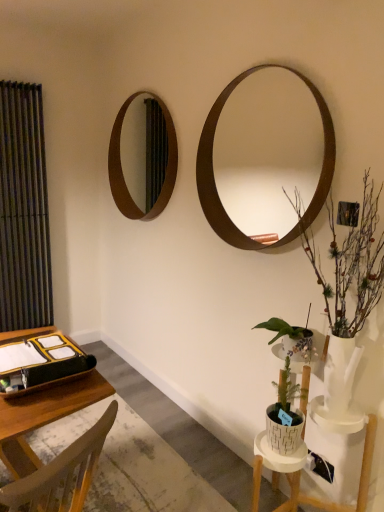
Consider the image. How much space does white textured pot at lower right, which is the 2th houseplant in top-to-bottom order, occupy vertically?

21.12 centimeters.

Measure the distance between point [304,354] and camera.

A distance of 1.69 meters exists between point [304,354] and camera.

Where is `matte black curtain at left`? The height and width of the screenshot is (512, 384). matte black curtain at left is located at coordinates (24, 211).

Between wooden desk at lower left and matte black binder at lower left, which one has less height?

matte black binder at lower left.

Can you confirm if wooden desk at lower left is thinner than matte black binder at lower left?

Incorrect, the width of wooden desk at lower left is not less than that of matte black binder at lower left.

Is wooden desk at lower left to the left of matte black binder at lower left from the viewer's perspective?

Incorrect, wooden desk at lower left is not on the left side of matte black binder at lower left.

From the image's perspective, does wooden desk at lower left appear higher than matte black binder at lower left?

No, from the image's perspective, wooden desk at lower left is not above matte black binder at lower left.

Image resolution: width=384 pixels, height=512 pixels. In order to click on the 1st houseplant counting from the right side of the brown wooden mirror at upper left, the second mirror in the right-to-left sequence in this screenshot , I will do `click(294, 344)`.

Is white textured pot at lower right, which is the 2th houseplant in top-to-bottom order, oriented towards brown wooden mirror at upper left, marked as the 1th mirror in a back-to-front arrangement?

No, white textured pot at lower right, which is the 2th houseplant in top-to-bottom order, is not oriented towards brown wooden mirror at upper left, marked as the 1th mirror in a back-to-front arrangement.

From the image's perspective, which one is positioned lower, white textured pot at lower right, which is the 2th houseplant in top-to-bottom order, or brown wooden mirror at upper left, the second mirror in the right-to-left sequence?

white textured pot at lower right, which is the 2th houseplant in top-to-bottom order, appears lower in the image.

Is the depth of white textured pot at lower right, which is the 2th houseplant in top-to-bottom order, greater than that of brown wooden mirror at upper left, arranged as the 2th mirror when viewed from the front?

No, the depth of white textured pot at lower right, which is the 2th houseplant in top-to-bottom order, is less than that of brown wooden mirror at upper left, arranged as the 2th mirror when viewed from the front.

Is brown wooden mirror at upper left, the 1th mirror positioned from the left, taller than matte black curtain at left?

Incorrect, the height of brown wooden mirror at upper left, the 1th mirror positioned from the left, is not larger of that of matte black curtain at left.

Can you confirm if brown wooden mirror at upper left, the 1th mirror positioned from the left, is bigger than matte black curtain at left?

No, brown wooden mirror at upper left, the 1th mirror positioned from the left, is not bigger than matte black curtain at left.

Considering the relative positions of brown wooden mirror at upper left, arranged as the 2th mirror when viewed from the front, and matte black curtain at left in the image provided, is brown wooden mirror at upper left, arranged as the 2th mirror when viewed from the front, in front of matte black curtain at left?

Yes, the depth of brown wooden mirror at upper left, arranged as the 2th mirror when viewed from the front, is less than that of matte black curtain at left.

Looking at this image, could you tell me if matte black curtain at left is facing brown wooden mirror at upper right, acting as the 1th mirror starting from the front?

No, matte black curtain at left is not aimed at brown wooden mirror at upper right, acting as the 1th mirror starting from the front.

How distant is matte black curtain at left from brown wooden mirror at upper right, the second mirror viewed from the left?

matte black curtain at left and brown wooden mirror at upper right, the second mirror viewed from the left, are 7.16 feet apart.

Which is more to the right, matte black curtain at left or brown wooden mirror at upper right, placed as the first mirror when sorted from right to left?

brown wooden mirror at upper right, placed as the first mirror when sorted from right to left.

From the image's perspective, is matte black curtain at left below brown wooden mirror at upper right, the second mirror viewed from the left?

Yes, from the image's perspective, matte black curtain at left is beneath brown wooden mirror at upper right, the second mirror viewed from the left.

Is brown wooden mirror at upper right, which appears as the second mirror when viewed from the back, far from matte black binder at lower left?

brown wooden mirror at upper right, which appears as the second mirror when viewed from the back, is far away from matte black binder at lower left.

Does point (310, 92) come behind point (10, 353)?

Yes.

Considering the relative sizes of brown wooden mirror at upper right, placed as the first mirror when sorted from right to left, and matte black binder at lower left in the image provided, is brown wooden mirror at upper right, placed as the first mirror when sorted from right to left, thinner than matte black binder at lower left?

Indeed, brown wooden mirror at upper right, placed as the first mirror when sorted from right to left, has a lesser width compared to matte black binder at lower left.

From a real-world perspective, relative to matte black binder at lower left, is brown wooden mirror at upper right, placed as the first mirror when sorted from right to left, vertically above or below?

brown wooden mirror at upper right, placed as the first mirror when sorted from right to left, is situated higher than matte black binder at lower left in the real world.

From the image's perspective, is matte black binder at lower left positioned above or below wooden desk at lower left?

matte black binder at lower left is situated higher than wooden desk at lower left in the image.

Are matte black binder at lower left and wooden desk at lower left far apart?

No, there isn't a large distance between matte black binder at lower left and wooden desk at lower left.

From their relative heights in the image, would you say matte black binder at lower left is taller or shorter than wooden desk at lower left?

Considering their sizes, matte black binder at lower left has less height than wooden desk at lower left.

From a real-world perspective, is white textured vase at right, positioned as the 1th houseplant in top-to-bottom order, over brown wooden mirror at upper left, the 1th mirror positioned from the left?

Incorrect, from a real-world perspective, white textured vase at right, positioned as the 1th houseplant in top-to-bottom order, is lower than brown wooden mirror at upper left, the 1th mirror positioned from the left.

From the image's perspective, relative to brown wooden mirror at upper left, arranged as the 2th mirror when viewed from the front, is white textured vase at right, the second houseplant when ordered from bottom to top, above or below?

Based on their image positions, white textured vase at right, the second houseplant when ordered from bottom to top, is located beneath brown wooden mirror at upper left, arranged as the 2th mirror when viewed from the front.

Is white textured vase at right, positioned as the 1th houseplant in top-to-bottom order, next to brown wooden mirror at upper left, arranged as the 2th mirror when viewed from the front, and touching it?

No, white textured vase at right, positioned as the 1th houseplant in top-to-bottom order, is not making contact with brown wooden mirror at upper left, arranged as the 2th mirror when viewed from the front.

Which object is positioned more to the left, white textured vase at right, positioned as the 1th houseplant in top-to-bottom order, or brown wooden mirror at upper left, marked as the 1th mirror in a back-to-front arrangement?

brown wooden mirror at upper left, marked as the 1th mirror in a back-to-front arrangement.

Image resolution: width=384 pixels, height=512 pixels. Find the location of `binder lying behind the wooden desk at lower left`. binder lying behind the wooden desk at lower left is located at coordinates coord(40,362).

Find the location of `mirror that is the 2nd object to the left of the white textured pot at lower right, which is the 2th houseplant in top-to-bottom order, starting at the anchor`. mirror that is the 2nd object to the left of the white textured pot at lower right, which is the 2th houseplant in top-to-bottom order, starting at the anchor is located at coordinates (144, 150).

Considering their positions, is white textured vase at right, the second houseplant when ordered from bottom to top, positioned closer to matte black binder at lower left than brown wooden mirror at upper left, the 1th mirror positioned from the left?

white textured vase at right, the second houseplant when ordered from bottom to top.

Which object lies further to the anchor point matte black curtain at left, matte black binder at lower left or white textured vase at right, the second houseplant when ordered from bottom to top?

Among the two, white textured vase at right, the second houseplant when ordered from bottom to top, is located further to matte black curtain at left.

Considering their positions, is matte black curtain at left positioned further to wooden desk at lower left than matte black binder at lower left?

matte black curtain at left lies further to wooden desk at lower left than the other object.

When comparing their distances from white textured vase at right, the second houseplant when ordered from bottom to top, does matte black curtain at left or brown wooden mirror at upper left, the 1th mirror positioned from the left, seem closer?

brown wooden mirror at upper left, the 1th mirror positioned from the left.

Estimate the real-world distances between objects in this image. Which object is closer to brown wooden mirror at upper left, the 1th mirror positioned from the left, matte black binder at lower left or brown wooden mirror at upper right, which appears as the second mirror when viewed from the back?

Based on the image, brown wooden mirror at upper right, which appears as the second mirror when viewed from the back, appears to be nearer to brown wooden mirror at upper left, the 1th mirror positioned from the left.

Looking at the image, which one is located closer to wooden desk at lower left, matte black binder at lower left or white textured vase at right, the second houseplant when ordered from bottom to top?

matte black binder at lower left lies closer to wooden desk at lower left than the other object.

Based on their spatial positions, is white textured vase at right, positioned as the 1th houseplant in top-to-bottom order, or white textured pot at lower right, acting as the 1th houseplant starting from the bottom, closer to brown wooden mirror at upper left, the second mirror in the right-to-left sequence?

white textured vase at right, positioned as the 1th houseplant in top-to-bottom order.

When comparing their distances from white textured vase at right, positioned as the 1th houseplant in top-to-bottom order, does wooden desk at lower left or brown wooden mirror at upper left, the 1th mirror positioned from the left, seem closer?

wooden desk at lower left is closer to white textured vase at right, positioned as the 1th houseplant in top-to-bottom order.

Where is `binder between matte black curtain at left and white textured pot at lower right, which is the 2th houseplant in top-to-bottom order, from left to right`? Image resolution: width=384 pixels, height=512 pixels. binder between matte black curtain at left and white textured pot at lower right, which is the 2th houseplant in top-to-bottom order, from left to right is located at coordinates (40, 362).

Locate an element on the screen. The height and width of the screenshot is (512, 384). mirror between brown wooden mirror at upper left, arranged as the 2th mirror when viewed from the front, and white textured pot at lower right, which is the 2th houseplant in top-to-bottom order, from top to bottom is located at coordinates (267, 150).

At what (x,y) coordinates should I click in order to perform the action: click on vanity between matte black binder at lower left and white textured pot at lower right, acting as the 1th houseplant starting from the bottom, from left to right. Please return your answer as a coordinate pair (x, y). Looking at the image, I should click on (43, 417).

Identify the location of mirror between wooden desk at lower left and brown wooden mirror at upper left, arranged as the 2th mirror when viewed from the front, in the front-back direction. The height and width of the screenshot is (512, 384). (267, 150).